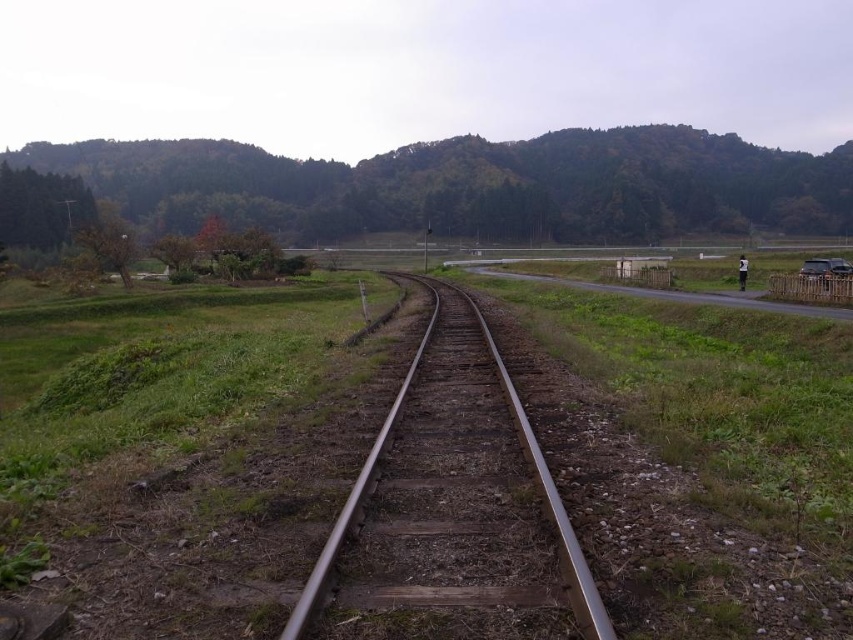
You are standing at the point marked as point (456,506) in the image. What object is directly beneath your feet?

The metal smooth track at center is located at point (456,506), so the object directly beneath your feet is the metal smooth track at center.